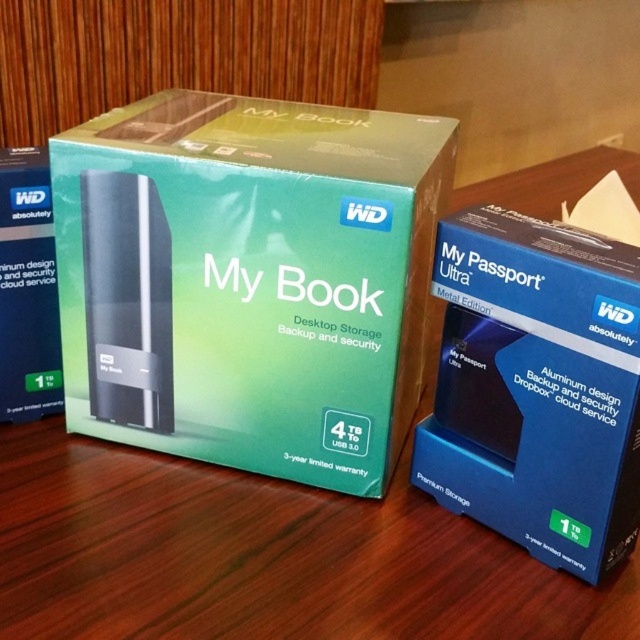
Is green matte box at center in front of blue aluminum my passport ultra at right?

No, it is not.

From the picture: Is green matte box at center above blue aluminum my passport ultra at right?

Correct, green matte box at center is located above blue aluminum my passport ultra at right.

Which is in front, point (154, 205) or point (516, 300)?

Point (516, 300)

Locate an element on the screen. The width and height of the screenshot is (640, 640). green matte box at center is located at coordinates point(248,280).

Between blue aluminum my passport ultra at right and matte black hard drive at left, which one has less height?

matte black hard drive at left

Who is more forward, (513,355) or (26,160)?

Positioned in front is point (513,355).

Is point (433, 486) behind point (29, 320)?

No, (433, 486) is closer to viewer.

You are a GUI agent. You are given a task and a screenshot of the screen. Output one action in this format:
    pyautogui.click(x=<x>, y=<y>)
    Task: Click on the blue aluminum my passport ultra at right
    
    Given the screenshot: What is the action you would take?
    pyautogui.click(x=536, y=387)

Which is below, green matte box at center or matte black hard drive at left?

matte black hard drive at left is lower down.

Who is positioned more to the right, green matte box at center or matte black hard drive at left?

Positioned to the right is green matte box at center.

At what (x,y) coordinates should I click in order to perform the action: click on green matte box at center. Please return your answer as a coordinate pair (x, y). The image size is (640, 640). Looking at the image, I should click on (248, 280).

Where is `green matte box at center`? green matte box at center is located at coordinates (248, 280).